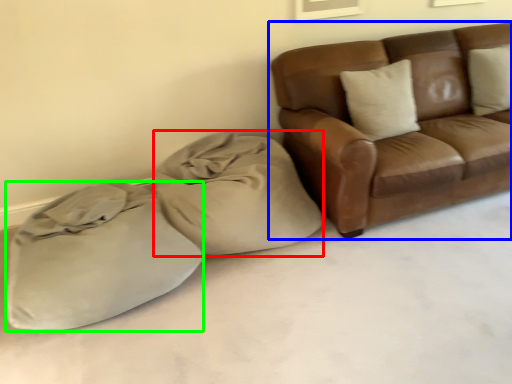
Question: Based on their relative distances, which object is nearer to bean bag chair (highlighted by a red box)? Choose from studio couch (highlighted by a blue box) and sack (highlighted by a green box).

Choices:
 (A) studio couch
 (B) sack

Answer: (B)